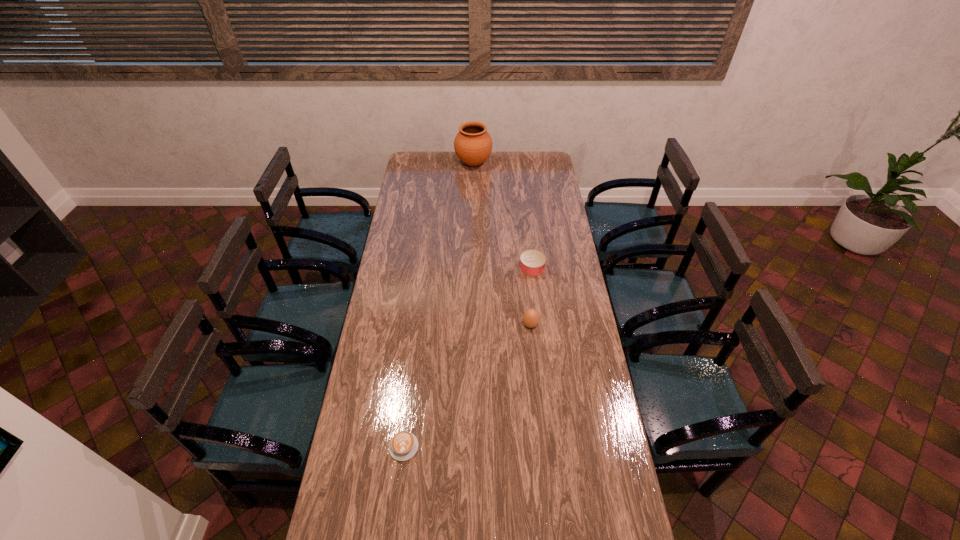
In order to click on free space located 0.150m on the front of the second farthest object in this screenshot , I will do `click(536, 302)`.

Where is `vacant space situated on the side of the shortest object with the handle`? vacant space situated on the side of the shortest object with the handle is located at coordinates (416, 352).

The image size is (960, 540). Identify the location of vacant space located 0.250m on the side of the shortest object with the handle. (414, 367).

I want to click on vacant area situated on the side of the shortest object with the handle, so 414,362.

Find the location of a particular element. object that is positioned at the far edge is located at coordinates (473, 144).

Identify the location of object located at the left edge. The height and width of the screenshot is (540, 960). (404, 445).

I want to click on object situated at the right edge, so click(x=532, y=262).

Find the location of a particular element. This screenshot has width=960, height=540. free space at the far edge of the desktop is located at coordinates (516, 166).

Where is `free space at the left edge of the desktop`? The height and width of the screenshot is (540, 960). free space at the left edge of the desktop is located at coordinates (403, 192).

The width and height of the screenshot is (960, 540). In the image, there is a desktop. Identify the location of free space at the right edge. (610, 462).